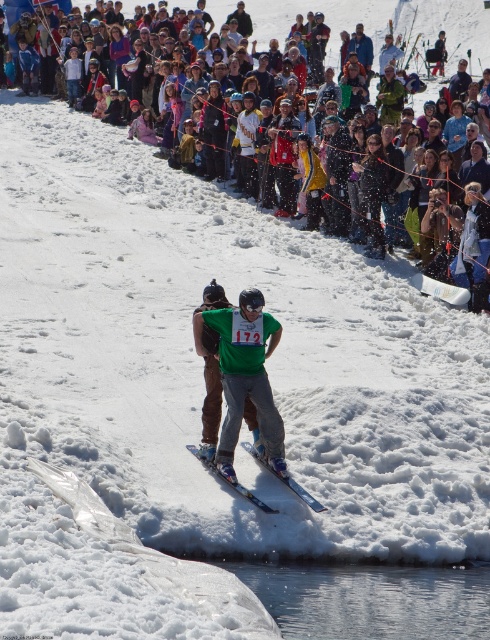
Question: Does green fabric snowboarder at center appear on the left side of shiny blue skis at center?

Choices:
 (A) yes
 (B) no

Answer: (A)

Question: Based on their relative distances, which object is nearer to the shiny blue skis at center?

Choices:
 (A) multicolored fabric crowd at upper center
 (B) green fabric snowboarder at center

Answer: (B)

Question: Is multicolored fabric crowd at upper center thinner than green fabric snowboarder at center?

Choices:
 (A) no
 (B) yes

Answer: (A)

Question: Can you confirm if multicolored fabric crowd at upper center is smaller than shiny blue skis at center?

Choices:
 (A) yes
 (B) no

Answer: (B)

Question: Which of these objects is positioned farthest from the green fabric snowboarder at center?

Choices:
 (A) multicolored fabric crowd at upper center
 (B) shiny blue skis at center

Answer: (A)

Question: Considering the real-world distances, which object is farthest from the multicolored fabric crowd at upper center?

Choices:
 (A) green fabric snowboarder at center
 (B) shiny blue skis at center

Answer: (B)